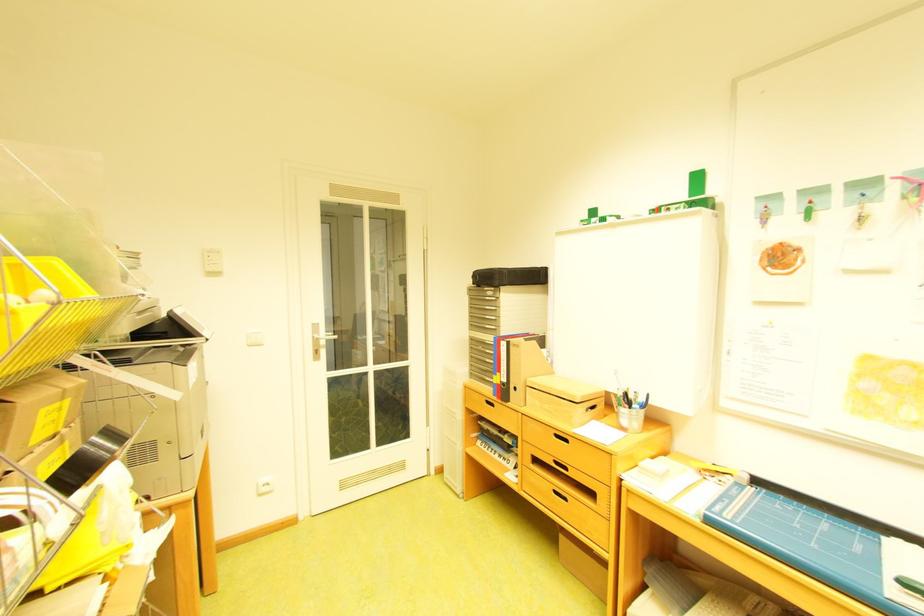
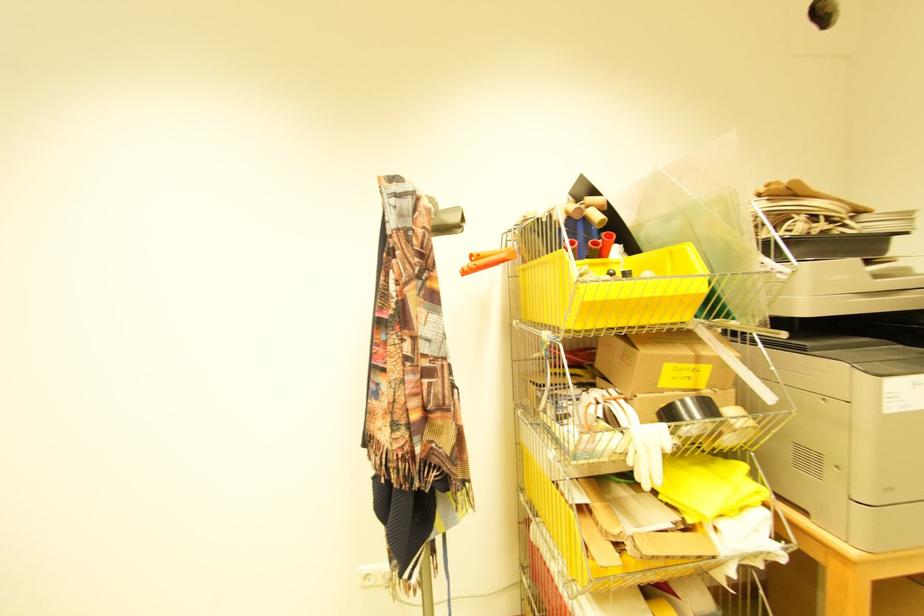
Question: The first image is from the beginning of the video and the second image is from the end. How did the camera likely rotate when shooting the video?

Choices:
 (A) Left
 (B) Right
 (C) Up
 (D) Down

Answer: (A)